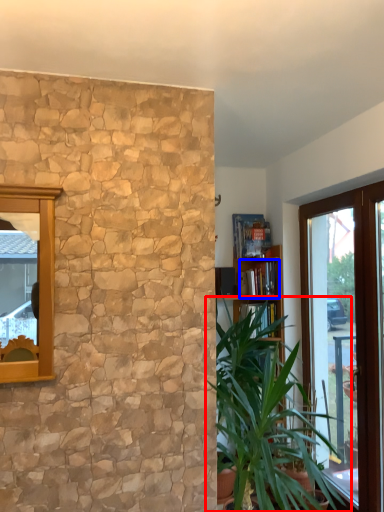
Question: Which of the following is the closest to the observer, houseplant (highlighted by a red box) or book (highlighted by a blue box)?

Choices:
 (A) houseplant
 (B) book

Answer: (A)